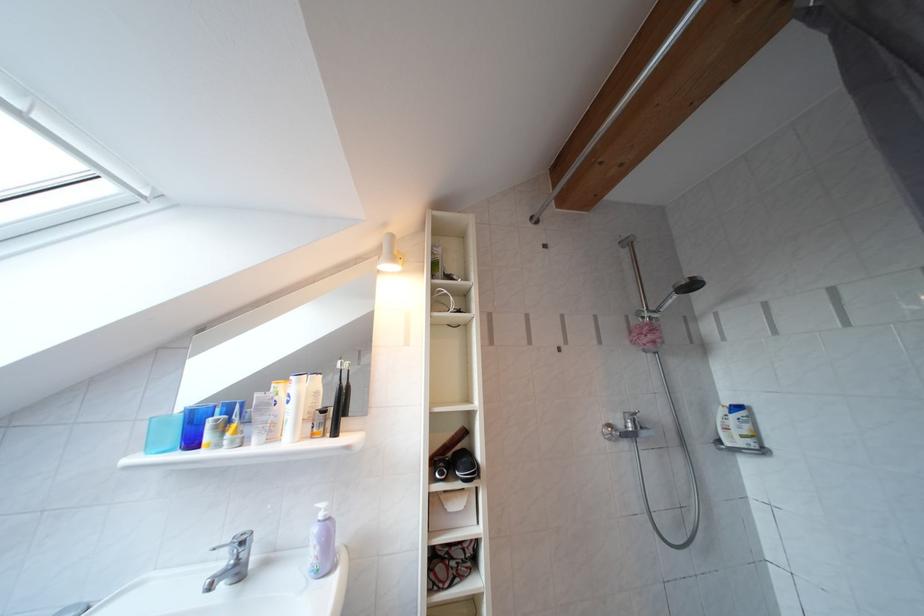
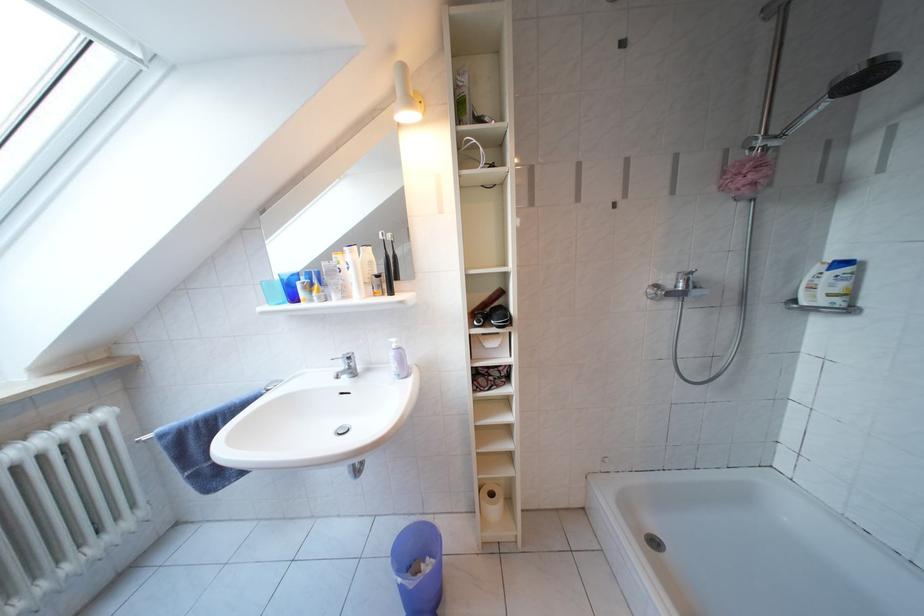
Locate, in the second image, the point that corresponds to [332,416] in the first image.

(386, 281)